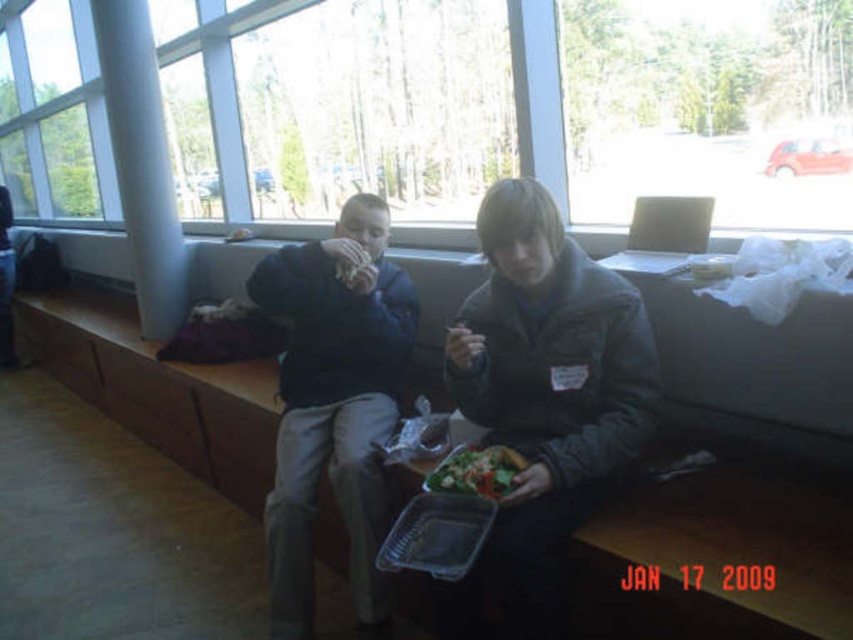
Based on the photo, you are a delivery person who needs to place a package on the bench between the transparent glass window at upper center and the green leafy salad at center. Can the package be placed there without blocking the window?

The transparent glass window at upper center is taller than the green leafy salad at center, so placing the package between them would not block the window since the window is taller and likely positioned above the salad.

You are standing at point [466,483] and want to move to the entrance located at point [215,10]. Which direction should you move to reach the entrance?

You should move backward because point [215,10] is behind point [466,483], so moving backward from your current position will lead you towards the entrance.

You are designing a new bench for this space and need to ensure there is enough room for both people wearing the dark gray jacket at center and dark blue jacket at center to sit comfortably. Based on their jacket sizes, which jacket wearer requires more space on the bench?

The dark gray jacket at center requires more space on the bench because its width is larger than the dark blue jacket at center.